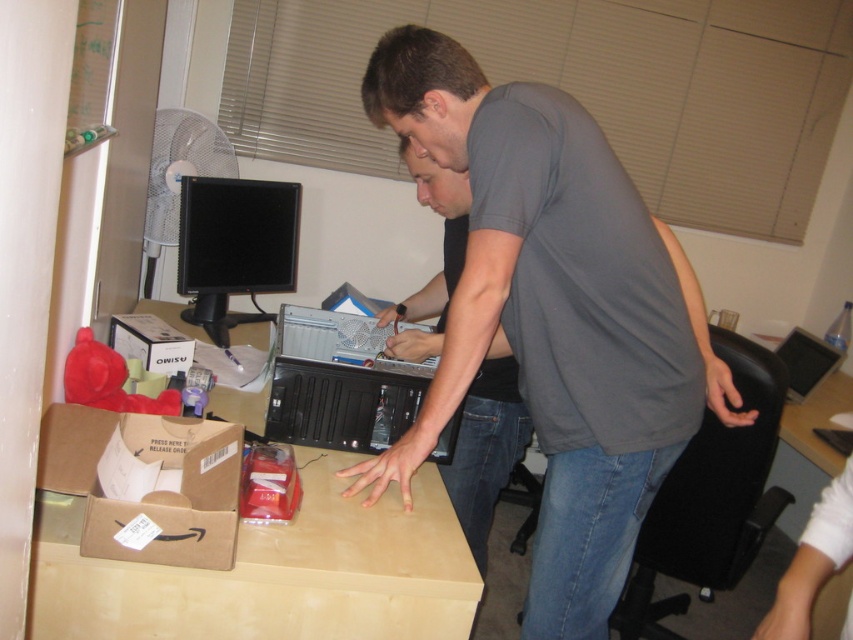
You are a delivery person who needs to place a new camera on the desk. The camera requires a minimum of 1.6 meters of space between it and the black plastic desktop computer at center to function properly. Can you place the camera on the desk without violating this requirement?

The black plastic desktop computer at center and camera are 1.57 meters apart, which is less than the required 1.6 meters. Therefore, placing the camera there would violate the space requirement.

You are organizing a small event in the office and need to clear space. Which object, the brown cardboard computer desk at center or the gray cotton shirt at center, should you move to free up more space?

The brown cardboard computer desk at center occupies less space than the gray cotton shirt at center, so moving the gray cotton shirt at center would free up more space.

You are a delivery person who needs to place a package on the brown cardboard computer desk at center without disturbing the gray cotton shirt at center. Can you fit the package if it measures 16 inches in length?

The brown cardboard computer desk at center and gray cotton shirt at center are 18.02 inches apart from each other. Since the package is 16 inches long, it can fit on the desk without disturbing the shirt as there is enough space between them.